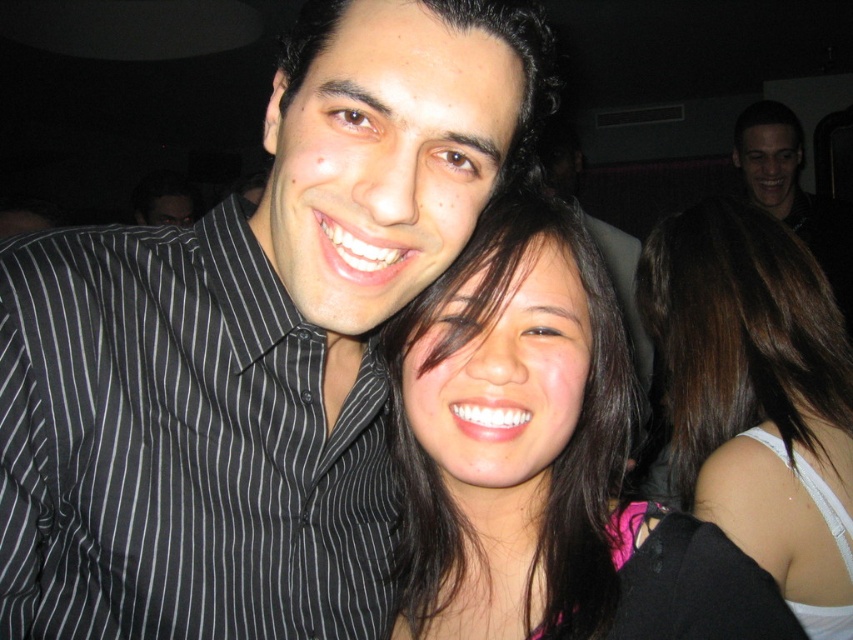
You are at a party and want to take a photo of the black striped shirt at center and dark brown hair at center. Which one is positioned higher in the frame?

The black striped shirt at center is located above the dark brown hair at center, so it is positioned higher in the frame.

You are at a party and want to take a photo of the dark brown hair at center and the black matte shirt at upper right. Which object should you focus on first if you want to capture both in the same frame?

The dark brown hair at center should be focused on first because it is positioned on the left side of the black matte shirt at upper right, so adjusting focus from left to right would ensure both are captured.

You are a photographer trying to capture a clear photo of the black striped shirt at center and the smooth dark hair at center. Since you want to focus on both objects equally, which one should you adjust your camera focus to prioritize based on their sizes?

The black striped shirt at center has a larger size compared to smooth dark hair at center, so you should prioritize focusing on the black striped shirt at center to ensure both are in focus.